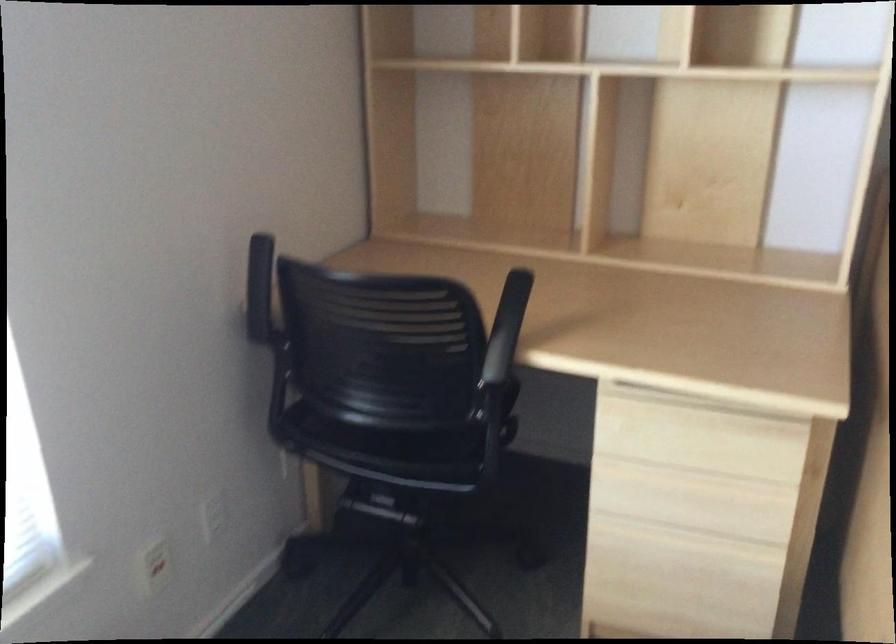
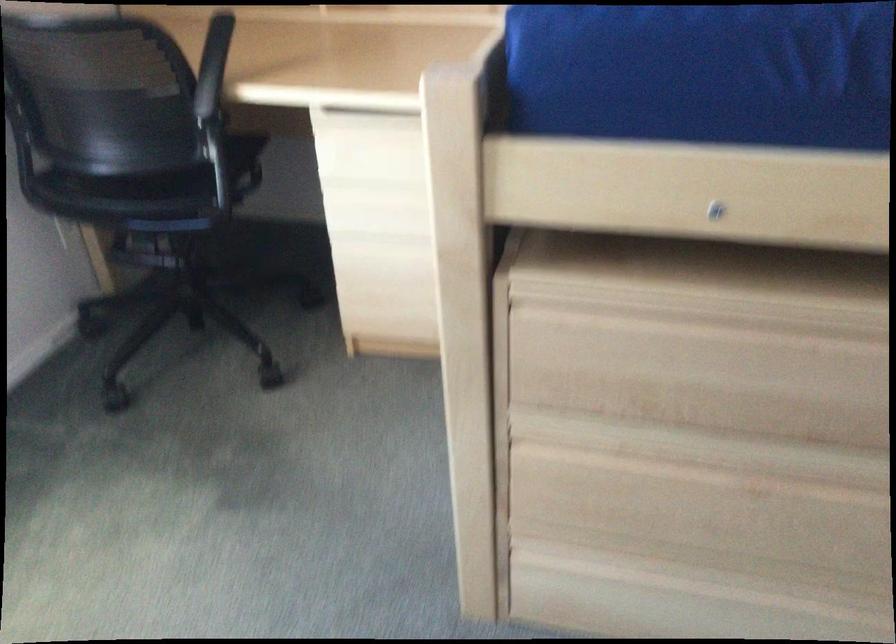
Question: I am providing you with two images of the same scene from different viewpoints. Which of the following objects are not visible in image2?

Choices:
 (A) black chair armrest
 (B) wooden drawer handle
 (C) chair sitting surface
 (D) none of these

Answer: (D)